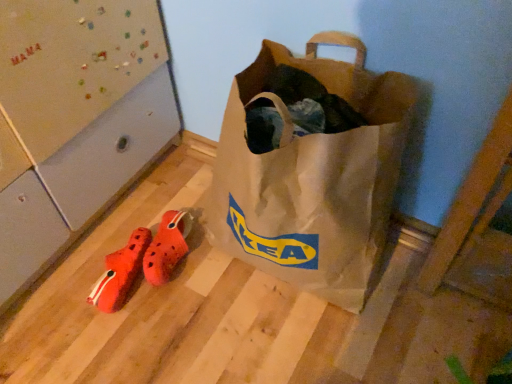
Image resolution: width=512 pixels, height=384 pixels. Identify the location of orange rubber clogs at lower left. (167, 247).

Can you tell me how much orange fabric shoe at lower left and matte brown paper bag at center differ in facing direction?

20.6 degrees.

Is orange fabric shoe at lower left smaller than matte brown paper bag at center?

Yes, orange fabric shoe at lower left is smaller than matte brown paper bag at center.

Is orange fabric shoe at lower left positioned in front of matte brown paper bag at center?

No, orange fabric shoe at lower left is further to the viewer.

Is orange fabric shoe at lower left to the left of matte brown paper bag at center from the viewer's perspective?

Yes, orange fabric shoe at lower left is to the left of matte brown paper bag at center.

Relative to matte brown paper bag at center, is orange rubber clogs at lower left in front or behind?

orange rubber clogs at lower left is positioned farther from the viewer than matte brown paper bag at center.

Consider the image. Is orange rubber clogs at lower left taller or shorter than matte brown paper bag at center?

Clearly, orange rubber clogs at lower left is shorter compared to matte brown paper bag at center.

How much distance is there between orange rubber clogs at lower left and matte brown paper bag at center?

A distance of 36.80 centimeters exists between orange rubber clogs at lower left and matte brown paper bag at center.

In the scene shown: Is orange rubber clogs at lower left wider than matte brown paper bag at center?

Incorrect, the width of orange rubber clogs at lower left does not surpass that of matte brown paper bag at center.

Looking at this image, from a real-world perspective, which is physically below, matte brown paper bag at center or orange rubber clogs at lower left?

In real-world perspective, orange rubber clogs at lower left is lower.

Does point (233, 125) lie in front of point (169, 246)?

Yes, point (233, 125) is closer to viewer.

In the scene shown: Considering the relative sizes of matte brown paper bag at center and orange rubber clogs at lower left in the image provided, is matte brown paper bag at center thinner than orange rubber clogs at lower left?

No.

Considering the sizes of matte brown paper bag at center and orange rubber clogs at lower left in the image, is matte brown paper bag at center taller or shorter than orange rubber clogs at lower left?

In the image, matte brown paper bag at center appears to be taller than orange rubber clogs at lower left.

Is orange fabric shoe at lower left bigger than orange rubber clogs at lower left?

Indeed, orange fabric shoe at lower left has a larger size compared to orange rubber clogs at lower left.

Considering the sizes of objects orange fabric shoe at lower left and orange rubber clogs at lower left in the image provided, who is wider, orange fabric shoe at lower left or orange rubber clogs at lower left?

orange rubber clogs at lower left.

Is orange fabric shoe at lower left far away from orange rubber clogs at lower left?

That's not correct — orange fabric shoe at lower left is a little close to orange rubber clogs at lower left.

From the picture: Is matte brown paper bag at center in front of or behind orange fabric shoe at lower left in the image?

Visually, matte brown paper bag at center is located in front of orange fabric shoe at lower left.

From the image's perspective, is matte brown paper bag at center above orange fabric shoe at lower left?

Yes, from the image's perspective, matte brown paper bag at center is on top of orange fabric shoe at lower left.

Does matte brown paper bag at center turn towards orange fabric shoe at lower left?

No.

Considering the sizes of matte brown paper bag at center and orange fabric shoe at lower left in the image, is matte brown paper bag at center taller or shorter than orange fabric shoe at lower left?

Clearly, matte brown paper bag at center is taller compared to orange fabric shoe at lower left.

From a real-world perspective, relative to orange fabric shoe at lower left, is orange rubber clogs at lower left vertically above or below?

From a real-world perspective, orange rubber clogs at lower left is physically above orange fabric shoe at lower left.

Based on the photo, from the image's perspective, which one is positioned higher, orange rubber clogs at lower left or orange fabric shoe at lower left?

From the image's view, orange rubber clogs at lower left is above.

In terms of width, does orange rubber clogs at lower left look wider or thinner when compared to orange fabric shoe at lower left?

Considering their sizes, orange rubber clogs at lower left looks broader than orange fabric shoe at lower left.

The height and width of the screenshot is (384, 512). Identify the location of footwear that is on the right side of orange fabric shoe at lower left. (167, 247).

At what (x,y) coordinates should I click in order to perform the action: click on luggage and bags on the right of orange fabric shoe at lower left. Please return your answer as a coordinate pair (x, y). This screenshot has height=384, width=512. Looking at the image, I should click on (313, 177).

Locate an element on the screen. luggage and bags above the orange rubber clogs at lower left (from the image's perspective) is located at coordinates (313, 177).

Looking at the image, which one is located closer to orange fabric shoe at lower left, orange rubber clogs at lower left or matte brown paper bag at center?

orange rubber clogs at lower left lies closer to orange fabric shoe at lower left than the other object.

From the image, which object appears to be nearer to orange fabric shoe at lower left, matte brown paper bag at center or orange rubber clogs at lower left?

orange rubber clogs at lower left is positioned closer to the anchor orange fabric shoe at lower left.

Based on their spatial positions, is orange fabric shoe at lower left or matte brown paper bag at center further from orange rubber clogs at lower left?

matte brown paper bag at center lies further to orange rubber clogs at lower left than the other object.

Based on the photo, estimate the real-world distances between objects in this image. Which object is closer to matte brown paper bag at center, orange rubber clogs at lower left or orange fabric shoe at lower left?

Among the two, orange rubber clogs at lower left is located nearer to matte brown paper bag at center.

Estimate the real-world distances between objects in this image. Which object is further from orange rubber clogs at lower left, matte brown paper bag at center or orange fabric shoe at lower left?

matte brown paper bag at center is further to orange rubber clogs at lower left.

Estimate the real-world distances between objects in this image. Which object is further from matte brown paper bag at center, orange fabric shoe at lower left or orange rubber clogs at lower left?

orange fabric shoe at lower left is positioned further to the anchor matte brown paper bag at center.

This screenshot has height=384, width=512. In order to click on shoe positioned between matte brown paper bag at center and orange rubber clogs at lower left from near to far in this screenshot , I will do `click(120, 273)`.